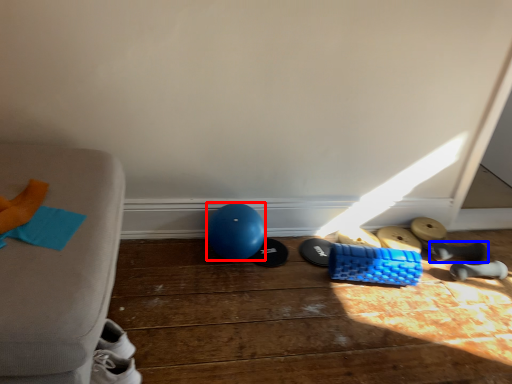
Question: Which of the following is the closest to the observer, balloon (highlighted by a red box) or footwear (highlighted by a blue box)?

Choices:
 (A) balloon
 (B) footwear

Answer: (A)